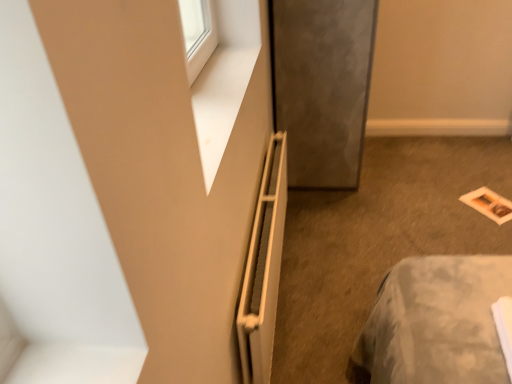
Identify the location of free space above matte paper magazine at lower right (from a real-world perspective). The height and width of the screenshot is (384, 512). (487, 201).